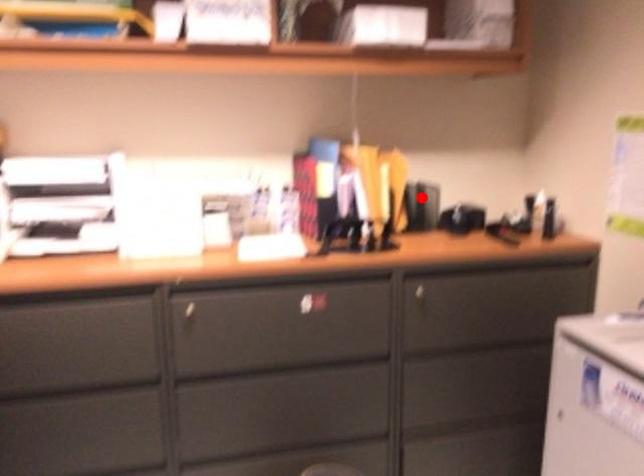
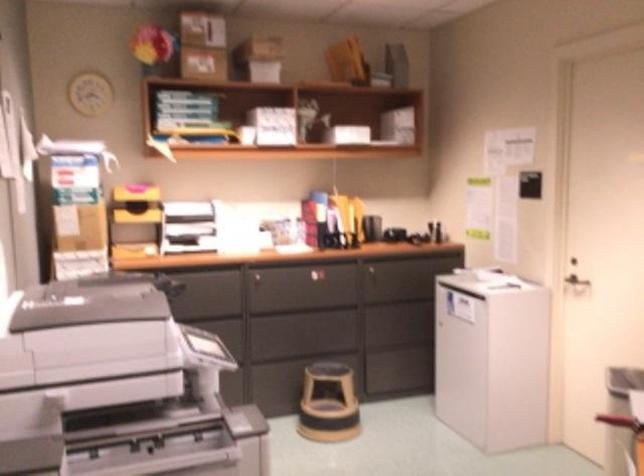
Locate, in the second image, the point that corresponds to the highlighted location in the first image.

(374, 222)